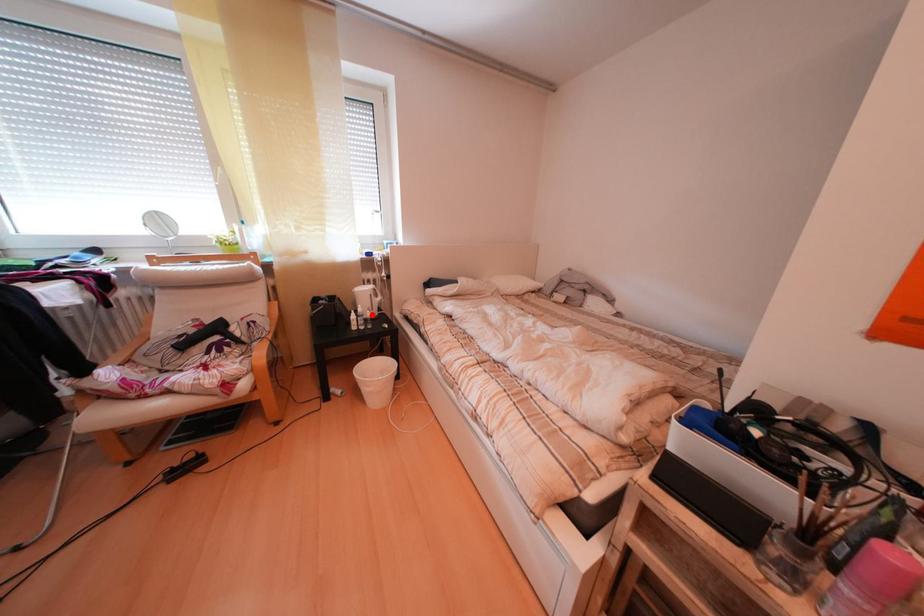
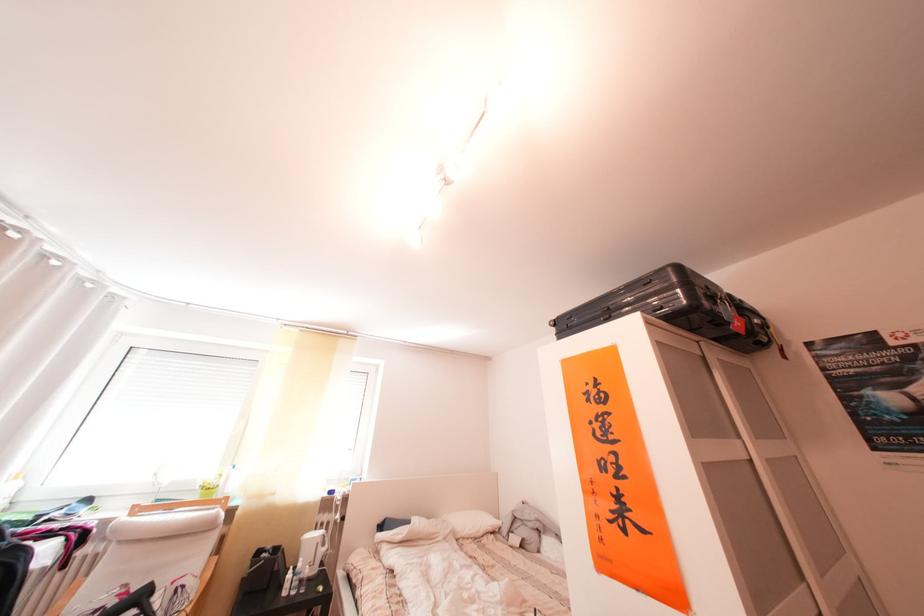
Question: I am providing you with two images of the same scene from different viewpoints. A red point is marked on the first image. At the location where the point appears in image 1, is it still visible in image 2?

Choices:
 (A) Yes
 (B) No

Answer: (A)